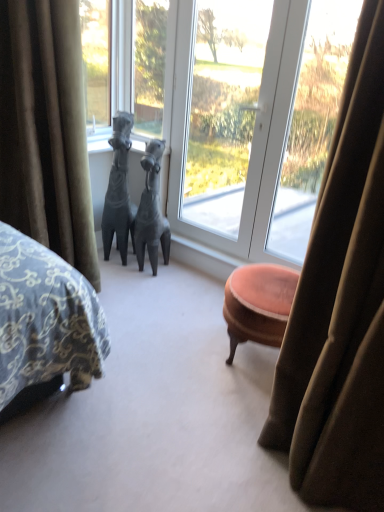
Question: Is matte gray horse at center, acting as the first animal starting from the right, positioned before transparent glass window at center?

Choices:
 (A) yes
 (B) no

Answer: (B)

Question: Considering the relative positions of matte gray horse at center, acting as the first animal starting from the right, and transparent glass window at center in the image provided, is matte gray horse at center, acting as the first animal starting from the right, to the right of transparent glass window at center from the viewer's perspective?

Choices:
 (A) no
 (B) yes

Answer: (A)

Question: Is matte gray horse at center, which is counted as the second animal, starting from the left, positioned beyond the bounds of transparent glass window at center?

Choices:
 (A) yes
 (B) no

Answer: (A)

Question: Is matte gray horse at center, which is counted as the second animal, starting from the left, positioned behind transparent glass window at center?

Choices:
 (A) no
 (B) yes

Answer: (B)

Question: Is transparent glass window at center at the back of matte gray horse at center, acting as the first animal starting from the right?

Choices:
 (A) no
 (B) yes

Answer: (B)

Question: Is velvet green curtain at left bigger than matte gray horse at center, acting as the first animal starting from the right?

Choices:
 (A) yes
 (B) no

Answer: (A)

Question: Is velvet green curtain at left to the right of matte gray horse at center, which is counted as the second animal, starting from the left, from the viewer's perspective?

Choices:
 (A) yes
 (B) no

Answer: (B)

Question: Does velvet green curtain at left touch matte gray horse at center, acting as the first animal starting from the right?

Choices:
 (A) no
 (B) yes

Answer: (A)

Question: From the image's perspective, is velvet green curtain at left over matte gray horse at center, which is counted as the second animal, starting from the left?

Choices:
 (A) yes
 (B) no

Answer: (A)

Question: From the image's perspective, is velvet green curtain at left below matte gray horse at center, which is counted as the second animal, starting from the left?

Choices:
 (A) yes
 (B) no

Answer: (B)

Question: Is velvet green curtain at left closer to camera compared to matte gray horse at center, acting as the first animal starting from the right?

Choices:
 (A) yes
 (B) no

Answer: (A)

Question: Considering the relative sizes of velvet green curtain at left and transparent glass window at center in the image provided, is velvet green curtain at left taller than transparent glass window at center?

Choices:
 (A) no
 (B) yes

Answer: (A)